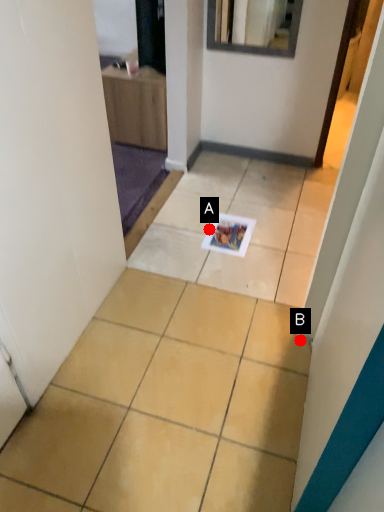
Question: Two points are circled on the image, labeled by A and B beside each circle. Which point is farther from the camera taking this photo?

Choices:
 (A) A is further
 (B) B is further

Answer: (A)